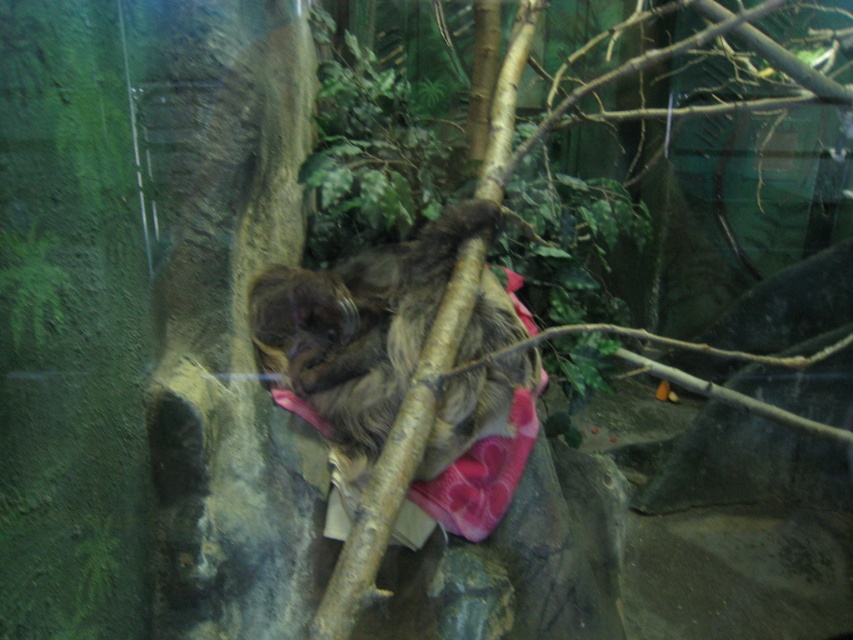
Between brown fuzzy sloth at center and brown furry tree at center, which one appears on the right side from the viewer's perspective?

brown furry tree at center

Can you confirm if brown fuzzy sloth at center is positioned below brown furry tree at center?

Yes.

Which is behind, point (387, 371) or point (364, 529)?

The point (387, 371) is more distant.

Where is `brown fuzzy sloth at center`? brown fuzzy sloth at center is located at coordinates (358, 324).